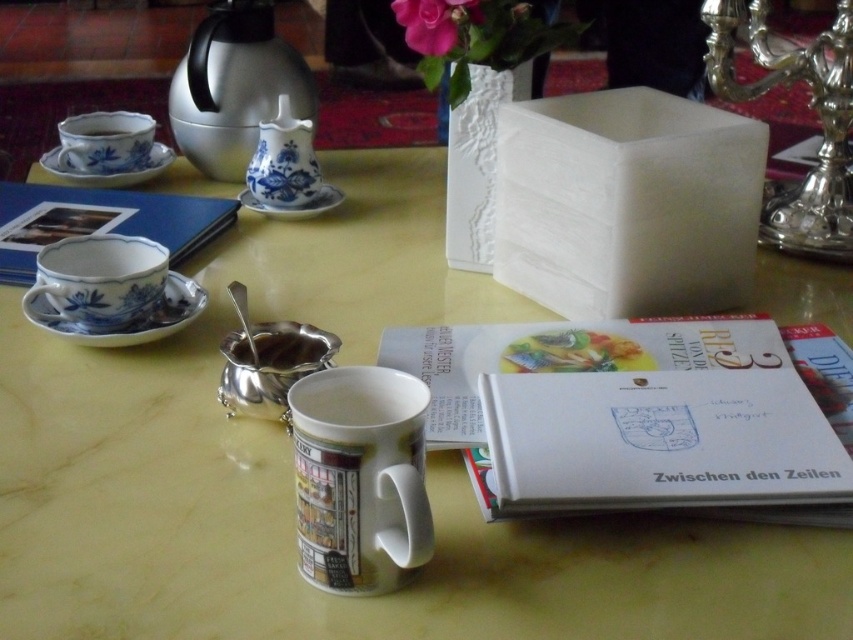
You are arranging items on a table and need to place a new item between the white paper book at center and the blue and white ceramic book at upper left. Based on their positions, where should you place it?

The white paper book at center is to the right of the blue and white ceramic book at upper left, so you should place the new item between them to the right of the blue and white ceramic book at upper left and to the left of the white paper book at center.

You are a librarian organizing books on a shelf. You have the white paper book at center and the blue and white ceramic book at upper left. Which book should you place first if you want to arrange them from smallest to largest?

The white paper book at center should be placed first because it is smaller than the blue and white ceramic book at upper left.

You are a customer sitting at the table and want to reach the blue porcelain tea pot at center to pour yourself a cup of tea. Considering your arm can comfortably reach up to 80 centimeters, can you comfortably reach the tea pot?

The blue porcelain tea pot at center is 77.50 centimeters away from the viewer. Since your arm can reach up to 80 centimeters, you can comfortably reach the tea pot.